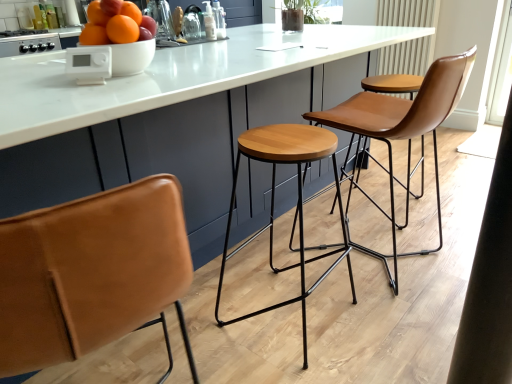
This screenshot has width=512, height=384. I want to click on shiny orange fruits at upper left, so click(x=116, y=24).

How much space does white glossy stove at upper left, which ranks as the 1th appliance in back-to-front order, occupy horizontally?

white glossy stove at upper left, which ranks as the 1th appliance in back-to-front order, is 25.30 inches in width.

Image resolution: width=512 pixels, height=384 pixels. What do you see at coordinates (29, 44) in the screenshot? I see `white glossy stove at upper left, the 1th appliance in the left-to-right sequence` at bounding box center [29, 44].

What are the coordinates of `white textured radiator at upper right` in the screenshot? It's located at (407, 57).

Where is `white matte bowl at upper center`? This screenshot has height=384, width=512. white matte bowl at upper center is located at coordinates (132, 57).

What is the approximate height of white marble table at center?

white marble table at center is 92.16 centimeters tall.

Image resolution: width=512 pixels, height=384 pixels. What do you see at coordinates (89, 64) in the screenshot? I see `white plastic device at upper center, the 1th appliance positioned from the bottom` at bounding box center [89, 64].

Locate an element on the screen. This screenshot has width=512, height=384. shiny orange fruits at upper left is located at coordinates (116, 24).

Consider the image. Which is nearer, [339,188] or [108,62]?

Point [339,188] appears to be farther away from the viewer than point [108,62].

Is white plastic device at upper center, which is counted as the first appliance, starting from the right, surrounded by wooden stool at center?

No, white plastic device at upper center, which is counted as the first appliance, starting from the right, is not surrounded by wooden stool at center.

From the image's perspective, is wooden stool at center located above white plastic device at upper center, which is the 2th appliance in top-to-bottom order?

No.

Image resolution: width=512 pixels, height=384 pixels. What are the coordinates of `appliance that is the 1st one below the shiny orange fruits at upper left (from a real-world perspective)` in the screenshot? It's located at (89, 64).

Is shiny orange fruits at upper left taller than white plastic device at upper center, which is counted as the first appliance, starting from the right?

Yes.

From the image's perspective, is shiny orange fruits at upper left on top of white plastic device at upper center, positioned as the second appliance in left-to-right order?

Yes, from the image's perspective, shiny orange fruits at upper left is over white plastic device at upper center, positioned as the second appliance in left-to-right order.

Is shiny orange fruits at upper left bigger than white plastic device at upper center, which is the 2th appliance in top-to-bottom order?

Yes, shiny orange fruits at upper left is bigger than white plastic device at upper center, which is the 2th appliance in top-to-bottom order.

Which object is closer to the camera taking this photo, white marble table at center or white plastic device at upper center, the 1th appliance positioned from the bottom?

Positioned in front is white marble table at center.

Does white marble table at center have a lesser width compared to white plastic device at upper center, positioned as the second appliance in left-to-right order?

No, white marble table at center is not thinner than white plastic device at upper center, positioned as the second appliance in left-to-right order.

What are the coordinates of `appliance that is the 1st object to the left of the white marble table at center, starting at the anchor` in the screenshot? It's located at (89, 64).

From a real-world perspective, relative to white plastic device at upper center, which is the 2th appliance in back-to-front order, is white marble table at center vertically above or below?

white marble table at center is situated lower than white plastic device at upper center, which is the 2th appliance in back-to-front order, in the real world.

From a real-world perspective, which object stands above the other?

brown leather chair at center.

Does brown leather chair at center contain wooden stool at center?

No.

Consider the image. Is brown leather chair at center positioned with its back to wooden stool at center?

That's not correct — brown leather chair at center is not looking away from wooden stool at center.

Which point is more distant from viewer, (x=51, y=50) or (x=108, y=69)?

The point (x=51, y=50) is behind.

Which is more to the right, white glossy stove at upper left, positioned as the 2th appliance in right-to-left order, or white plastic device at upper center, which is the 2th appliance in back-to-front order?

white plastic device at upper center, which is the 2th appliance in back-to-front order.

Image resolution: width=512 pixels, height=384 pixels. What are the coordinates of `appliance in front of the white glossy stove at upper left, the 1th appliance in the left-to-right sequence` in the screenshot? It's located at (89, 64).

Which of these two, white glossy stove at upper left, positioned as the 1th appliance in top-to-bottom order, or white plastic device at upper center, which is the 2th appliance in top-to-bottom order, is wider?

Wider between the two is white glossy stove at upper left, positioned as the 1th appliance in top-to-bottom order.

Is white plastic device at upper center, acting as the first appliance starting from the front, inside or outside of white matte bowl at upper center?

white plastic device at upper center, acting as the first appliance starting from the front, is outside white matte bowl at upper center.

Identify the location of appliance lying below the white matte bowl at upper center (from the image's perspective). (89, 64).

What's the angular difference between white plastic device at upper center, positioned as the second appliance in left-to-right order, and white matte bowl at upper center's facing directions?

The angle between the facing direction of white plastic device at upper center, positioned as the second appliance in left-to-right order, and the facing direction of white matte bowl at upper center is 44.6 degrees.

Does point (103, 73) come in front of point (112, 65)?

Yes.

Relative to white matte bowl at upper center, is white marble table at center in front or behind?

white marble table at center is in front of white matte bowl at upper center.

From the image's perspective, is white marble table at center below white matte bowl at upper center?

Indeed, from the image's perspective, white marble table at center is shown beneath white matte bowl at upper center.

How many degrees apart are the facing directions of white marble table at center and white matte bowl at upper center?

They differ by 0.307 degrees in their facing directions.

Is white marble table at center in contact with white matte bowl at upper center?

white marble table at center is not next to white matte bowl at upper center, and they're not touching.

Where is `the 1st appliance to the left when counting from the wooden stool at center`? the 1st appliance to the left when counting from the wooden stool at center is located at coordinates (89, 64).

The image size is (512, 384). What are the coordinates of `fruit above the white plastic device at upper center, which is the 2th appliance in top-to-bottom order (from a real-world perspective)` in the screenshot? It's located at (116, 24).

Looking at the image, which one is located closer to white plastic device at upper center, which is the 2th appliance in back-to-front order, white marble table at center or white glossy stove at upper left, positioned as the 2th appliance in right-to-left order?

white marble table at center is closer to white plastic device at upper center, which is the 2th appliance in back-to-front order.

From the image, which object appears to be nearer to wooden stool at center, white marble table at center or brown leather chair at center?

Based on the image, brown leather chair at center appears to be nearer to wooden stool at center.

When comparing their distances from white textured radiator at upper right, does brown leather chair at center or white plastic device at upper center, positioned as the second appliance in left-to-right order, seem closer?

brown leather chair at center is positioned closer to the anchor white textured radiator at upper right.

When comparing their distances from white textured radiator at upper right, does brown leather chair at center or white glossy stove at upper left, positioned as the 2th appliance in right-to-left order, seem further?

The object further to white textured radiator at upper right is white glossy stove at upper left, positioned as the 2th appliance in right-to-left order.

Estimate the real-world distances between objects in this image. Which object is further from white matte bowl at upper center, white glossy stove at upper left, which ranks as the 1th appliance in back-to-front order, or white marble table at center?

white glossy stove at upper left, which ranks as the 1th appliance in back-to-front order, lies further to white matte bowl at upper center than the other object.

Which object lies nearer to the anchor point brown leather chair at center, white marble table at center or white plastic device at upper center, the 1th appliance positioned from the bottom?

Based on the image, white marble table at center appears to be nearer to brown leather chair at center.

When comparing their distances from white glossy stove at upper left, positioned as the 2th appliance in right-to-left order, does white plastic device at upper center, the 1th appliance positioned from the bottom, or white matte bowl at upper center seem closer?

white matte bowl at upper center is closer to white glossy stove at upper left, positioned as the 2th appliance in right-to-left order.

From the image, which object appears to be nearer to white marble table at center, brown leather chair at center or wooden stool at center?

wooden stool at center is closer to white marble table at center.

Identify the location of chair between white marble table at center and white textured radiator at upper right along the z-axis. The width and height of the screenshot is (512, 384). (401, 131).

Locate an element on the screen. This screenshot has height=384, width=512. table between white plastic device at upper center, acting as the first appliance starting from the front, and wooden stool at center from left to right is located at coordinates (170, 76).

Find the location of a particular element. bowl between white plastic device at upper center, which is counted as the first appliance, starting from the right, and wooden stool at center is located at coordinates (132, 57).

This screenshot has height=384, width=512. Identify the location of table between white matte bowl at upper center and brown leather chair at center. (170, 76).